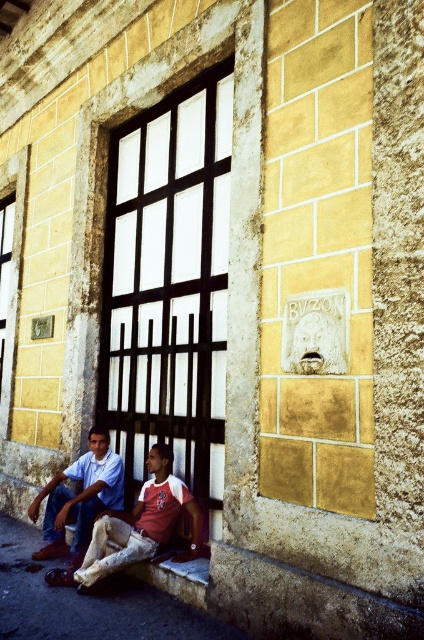
Does wooden bars at center have a lesser width compared to white cotton shirt at lower left?

Incorrect, wooden bars at center's width is not less than white cotton shirt at lower left's.

What do you see at coordinates (169, 285) in the screenshot? This screenshot has width=424, height=640. I see `wooden bars at center` at bounding box center [169, 285].

This screenshot has width=424, height=640. Find the location of `wooden bars at center`. wooden bars at center is located at coordinates (169, 285).

You are a GUI agent. You are given a task and a screenshot of the screen. Output one action in this format:
    pyautogui.click(x=<x>, y=<y>)
    Task: Click on the white cotton shirt at lower left
    The height and width of the screenshot is (640, 424).
    Given the screenshot: What is the action you would take?
    pyautogui.click(x=136, y=525)

In the scene shown: Between white cotton shirt at lower left and matte blue jeans at lower left, which one has more height?

Standing taller between the two is matte blue jeans at lower left.

Locate an element on the screen. white cotton shirt at lower left is located at coordinates (136, 525).

Is wooden bars at center below matte blue jeans at lower left?

Actually, wooden bars at center is above matte blue jeans at lower left.

What do you see at coordinates (169, 285) in the screenshot? I see `wooden bars at center` at bounding box center [169, 285].

Where is `wooden bars at center`? The height and width of the screenshot is (640, 424). wooden bars at center is located at coordinates (169, 285).